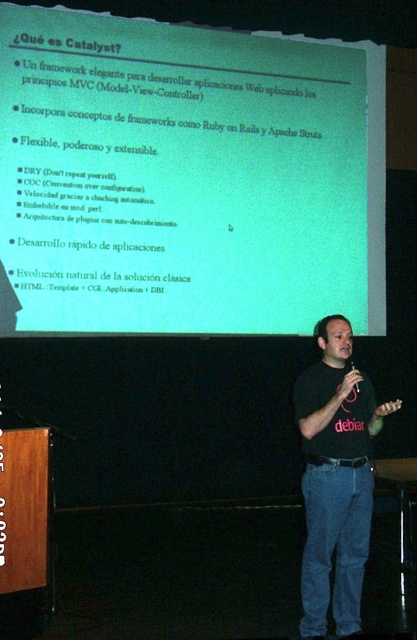
Question: Does green matte projector screen at upper center appear under black cotton shirt at center?

Choices:
 (A) yes
 (B) no

Answer: (B)

Question: Which object appears farthest from the camera in this image?

Choices:
 (A) black cotton shirt at center
 (B) green matte projector screen at upper center

Answer: (B)

Question: Does green matte projector screen at upper center appear on the right side of black cotton shirt at center?

Choices:
 (A) yes
 (B) no

Answer: (B)

Question: Among these objects, which one is farthest from the camera?

Choices:
 (A) black cotton shirt at center
 (B) green matte projector screen at upper center

Answer: (B)

Question: Can you confirm if green matte projector screen at upper center is positioned to the left of black cotton shirt at center?

Choices:
 (A) no
 (B) yes

Answer: (B)

Question: Which point is closer to the camera?

Choices:
 (A) (341, 556)
 (B) (55, 179)

Answer: (A)